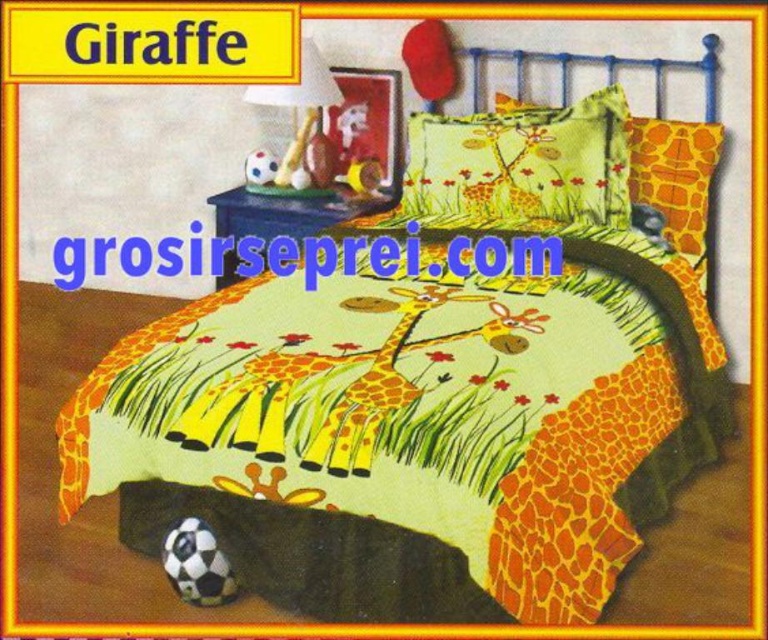
Question: Can you confirm if yellow giraffe-patterned pillow at upper right is wider than matte plastic lamp at upper center?

Choices:
 (A) no
 (B) yes

Answer: (A)

Question: Which object is the farthest from the matte plastic lamp at upper center?

Choices:
 (A) matte yellow pillow with giraffe design at center
 (B) yellow giraffe-patterned pillow at upper right

Answer: (B)

Question: Which is nearer to the matte yellow pillow with giraffe design at center?

Choices:
 (A) matte plastic lamp at upper center
 (B) yellow giraffe-patterned pillow at upper right

Answer: (B)

Question: Does matte yellow pillow with giraffe design at center come behind matte plastic lamp at upper center?

Choices:
 (A) yes
 (B) no

Answer: (B)

Question: Can you confirm if matte yellow pillow with giraffe design at center is smaller than yellow giraffe-patterned pillow at upper right?

Choices:
 (A) no
 (B) yes

Answer: (A)

Question: Which of the following is the closest to the observer?

Choices:
 (A) (517, 120)
 (B) (714, 148)
 (C) (303, 120)

Answer: (B)